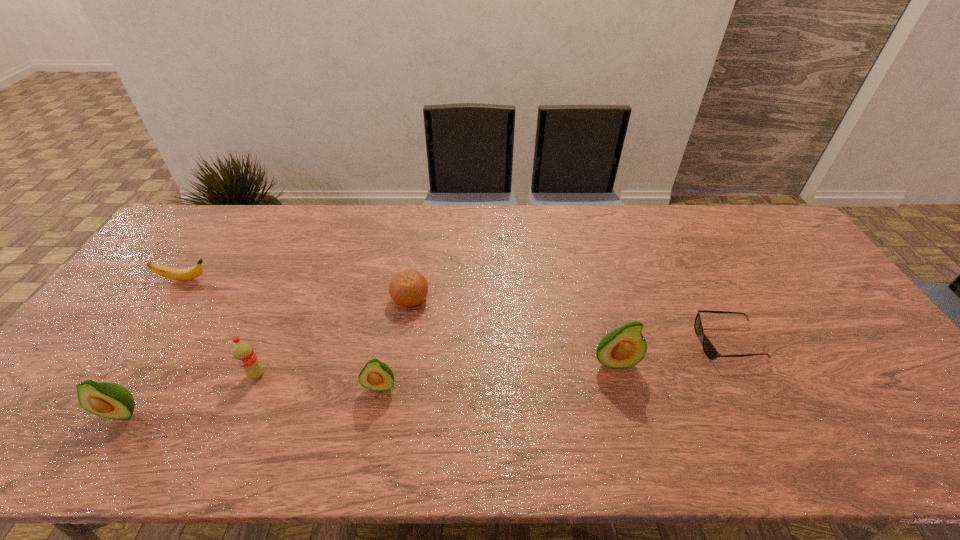
I want to click on free space at the far edge of the desktop, so click(x=416, y=236).

Where is `free space at the near edge of the desktop`? free space at the near edge of the desktop is located at coordinates (312, 400).

Where is `free space at the right edge of the desktop`? The width and height of the screenshot is (960, 540). free space at the right edge of the desktop is located at coordinates (795, 273).

In the image, there is a desktop. Find the location of `vacant area at the far left corner`. vacant area at the far left corner is located at coordinates (215, 213).

Find the location of a particular element. The image size is (960, 540). free space at the far right corner is located at coordinates (744, 230).

The image size is (960, 540). Identify the location of vacant space in between the nearest avocado and the farthest object. (154, 346).

Find the location of a particular element. free space that is in between the nearest avocado and the banana is located at coordinates (154, 346).

The height and width of the screenshot is (540, 960). Identify the location of free spot between the second avocado from left to right and the sunglasses. [554, 364].

You are a GUI agent. You are given a task and a screenshot of the screen. Output one action in this format:
    pyautogui.click(x=<x>, y=<y>)
    Task: Click on the free space that is in between the nearest avocado and the sunglasses
    The height and width of the screenshot is (540, 960).
    Given the screenshot: What is the action you would take?
    pyautogui.click(x=425, y=377)

Image resolution: width=960 pixels, height=540 pixels. Find the location of `free spot between the shortest object and the second avocado from right to left`. free spot between the shortest object and the second avocado from right to left is located at coordinates (554, 364).